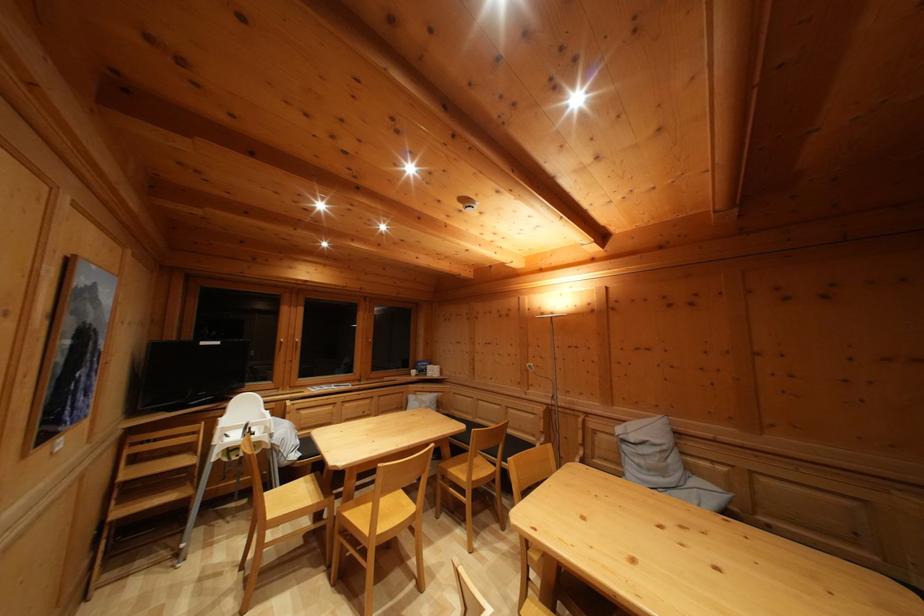
The location [415,375] corresponds to which object?

This point indicates the white mug.